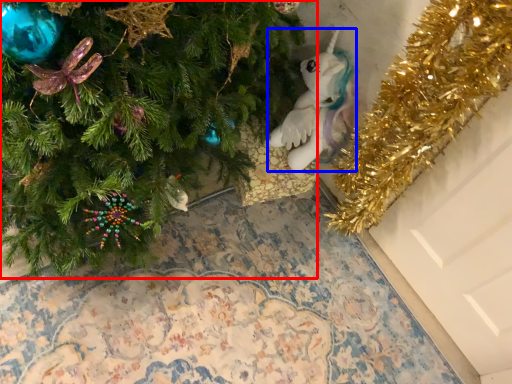
Question: Which object appears farthest to the camera in this image, christmas tree (highlighted by a red box) or toy (highlighted by a blue box)?

Choices:
 (A) christmas tree
 (B) toy

Answer: (B)